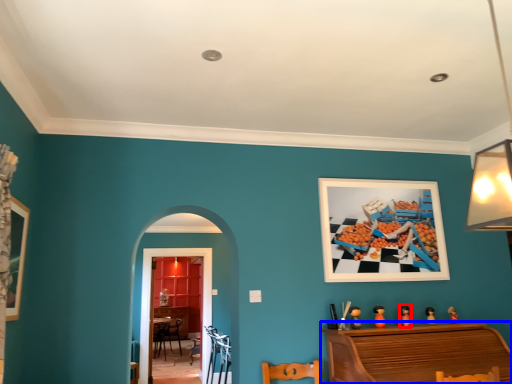
Question: Which point is further to the camera, toy (highlighted by a red box) or furniture (highlighted by a blue box)?

Choices:
 (A) toy
 (B) furniture

Answer: (A)